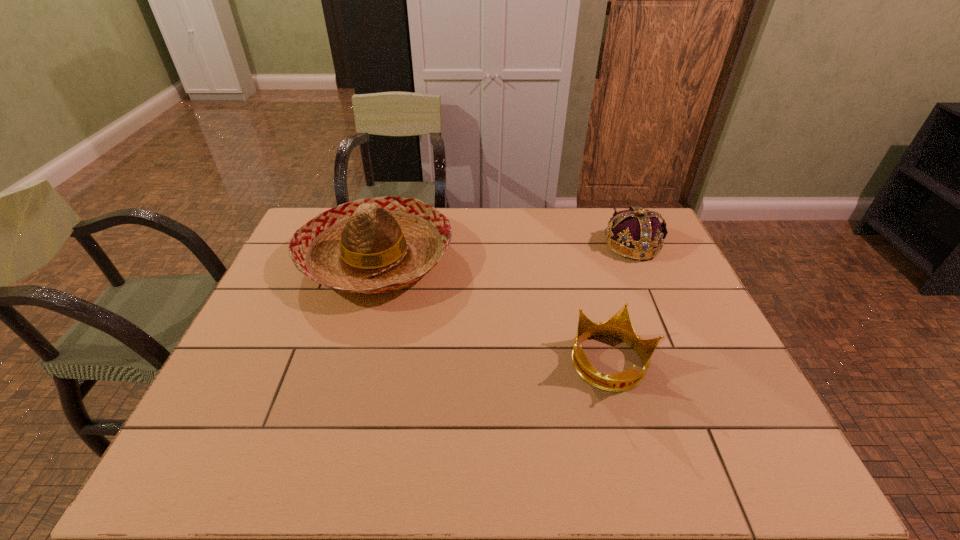
You are a GUI agent. You are given a task and a screenshot of the screen. Output one action in this format:
    pyautogui.click(x=<x>, y=<y>)
    Task: Click on the sombrero
    
    Given the screenshot: What is the action you would take?
    pyautogui.click(x=383, y=244)

Locate an element on the screen. The height and width of the screenshot is (540, 960). the leftmost object is located at coordinates pos(383,244).

Locate an element on the screen. the taller crown is located at coordinates (641, 236).

Where is `the farther crown`? Image resolution: width=960 pixels, height=540 pixels. the farther crown is located at coordinates (641, 236).

This screenshot has width=960, height=540. I want to click on the nearest object, so click(x=619, y=326).

Where is `the shortest object`? This screenshot has height=540, width=960. the shortest object is located at coordinates (619, 326).

I want to click on free space located on the front of the leftmost object, so click(x=340, y=386).

Where is `free space located on the left of the farther crown`? free space located on the left of the farther crown is located at coordinates (532, 245).

Locate an element on the screen. This screenshot has width=960, height=540. vacant space located on the back of the nearest object is located at coordinates (597, 316).

Where is `sombrero at the far edge`? sombrero at the far edge is located at coordinates (383, 244).